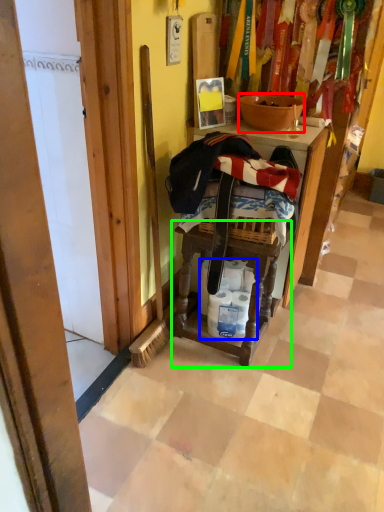
Question: Which object is the farthest from bowl (highlighted by a red box)? Choose among these: toilet paper (highlighted by a blue box) or step stool (highlighted by a green box).

Choices:
 (A) toilet paper
 (B) step stool

Answer: (A)